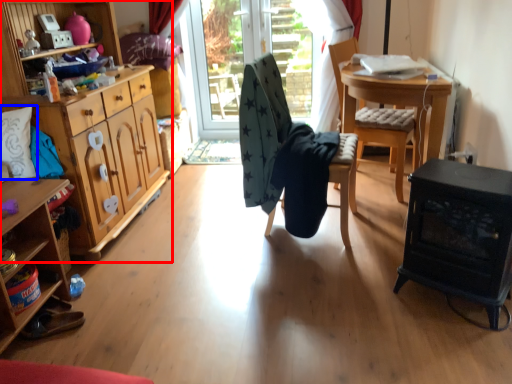
Question: Which object is closer to the camera taking this photo, cabinetry (highlighted by a red box) or pillow (highlighted by a blue box)?

Choices:
 (A) cabinetry
 (B) pillow

Answer: (A)